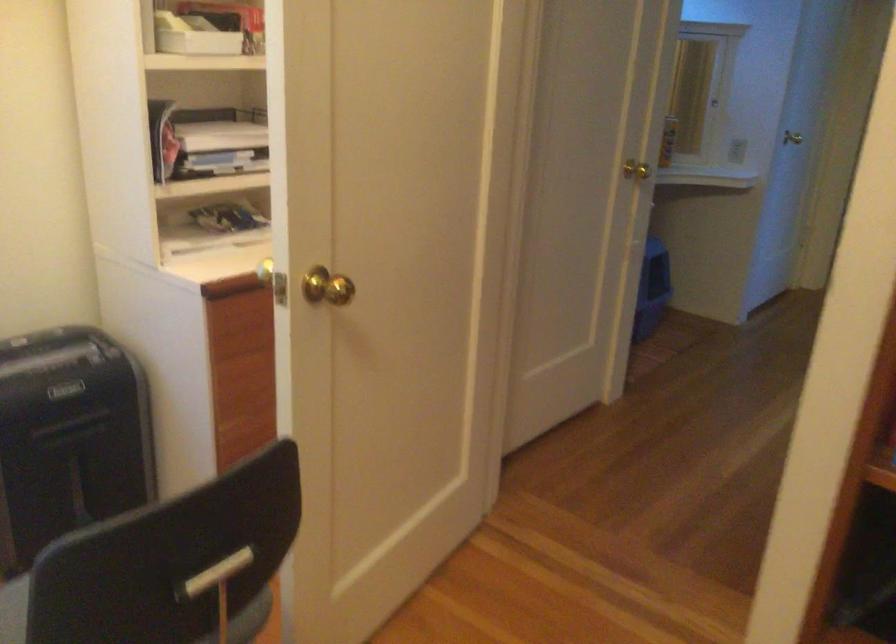
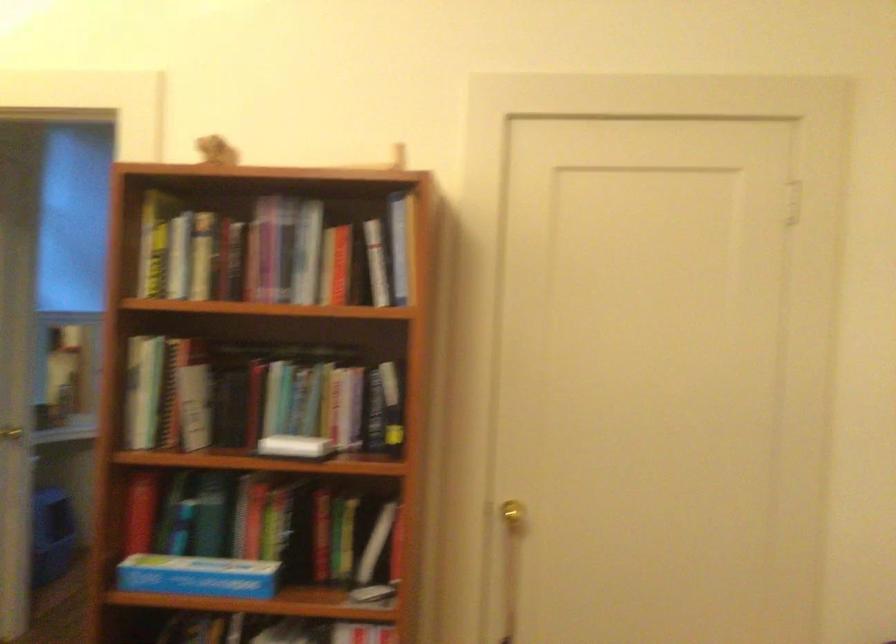
The point at (x=648, y=180) is marked in the first image. Where is the corresponding point in the second image?

(11, 433)